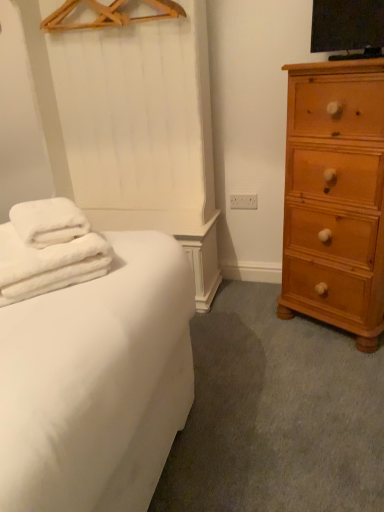
Question: From the image's perspective, is light brown wooden chest of drawers at right above white fluffy towels at left?

Choices:
 (A) no
 (B) yes

Answer: (B)

Question: Does light brown wooden chest of drawers at right appear on the left side of white fluffy towels at left?

Choices:
 (A) no
 (B) yes

Answer: (A)

Question: From the image's perspective, is light brown wooden chest of drawers at right beneath white fluffy towels at left?

Choices:
 (A) no
 (B) yes

Answer: (A)

Question: Could you tell me if light brown wooden chest of drawers at right is turned towards white fluffy towels at left?

Choices:
 (A) yes
 (B) no

Answer: (A)

Question: Is light brown wooden chest of drawers at right in front of white fluffy towels at left?

Choices:
 (A) no
 (B) yes

Answer: (A)

Question: In the image, is light brown wooden chest of drawers at right on the left side or the right side of wooden hanger at upper center?

Choices:
 (A) right
 (B) left

Answer: (A)

Question: In the image, is light brown wooden chest of drawers at right positioned in front of or behind wooden hanger at upper center?

Choices:
 (A) behind
 (B) front

Answer: (B)

Question: Is light brown wooden chest of drawers at right spatially inside wooden hanger at upper center, or outside of it?

Choices:
 (A) outside
 (B) inside

Answer: (A)

Question: From the image's perspective, relative to wooden hanger at upper center, is light brown wooden chest of drawers at right above or below?

Choices:
 (A) below
 (B) above

Answer: (A)

Question: Is light brown wooden chest of drawers at right wider or thinner than white fluffy towels at left?

Choices:
 (A) thin
 (B) wide

Answer: (A)

Question: Based on their sizes in the image, would you say light brown wooden chest of drawers at right is bigger or smaller than white fluffy towels at left?

Choices:
 (A) big
 (B) small

Answer: (A)

Question: From a real-world perspective, is light brown wooden chest of drawers at right above or below white fluffy towels at left?

Choices:
 (A) above
 (B) below

Answer: (B)

Question: Is light brown wooden chest of drawers at right spatially inside white fluffy towels at left, or outside of it?

Choices:
 (A) inside
 (B) outside

Answer: (B)

Question: Considering the positions of wooden hanger at upper center and white fluffy towels at left in the image, is wooden hanger at upper center taller or shorter than white fluffy towels at left?

Choices:
 (A) tall
 (B) short

Answer: (B)

Question: From a real-world perspective, is wooden hanger at upper center positioned above or below white fluffy towels at left?

Choices:
 (A) above
 (B) below

Answer: (A)